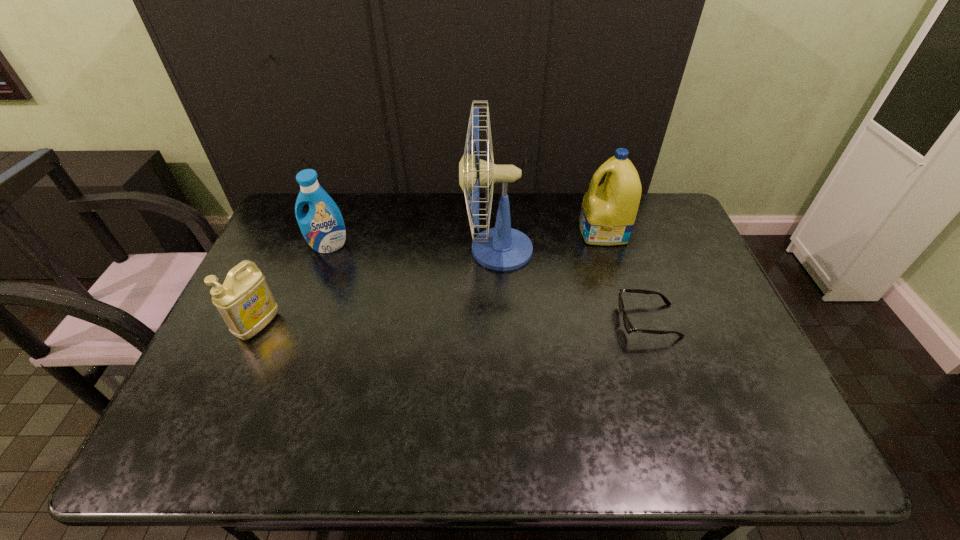
At what (x,y) coordinates should I click in order to perform the action: click on vacant space at the near edge of the desktop. Please return your answer as a coordinate pair (x, y). Looking at the image, I should click on (297, 445).

Where is `blank space at the left edge`? blank space at the left edge is located at coordinates (274, 335).

The image size is (960, 540). Identify the location of vacant area at the right edge of the desktop. (660, 262).

The width and height of the screenshot is (960, 540). What are the coordinates of `vacant space at the near left corner` in the screenshot? It's located at (180, 447).

Image resolution: width=960 pixels, height=540 pixels. What are the coordinates of `unoccupied area between the spectacles and the rightmost detergent` in the screenshot? It's located at coord(626,276).

What are the coordinates of `vacant point located between the nearest detergent and the rightmost detergent` in the screenshot? It's located at (431, 279).

Find the location of a particular element. Image resolution: width=960 pixels, height=540 pixels. free area in between the rightmost detergent and the shortest object is located at coordinates (626, 276).

The width and height of the screenshot is (960, 540). Find the location of `vacant point located between the fan and the nearest detergent`. vacant point located between the fan and the nearest detergent is located at coordinates (378, 287).

This screenshot has height=540, width=960. Find the location of `vacant space that is in between the rightmost detergent and the fan`. vacant space that is in between the rightmost detergent and the fan is located at coordinates (550, 241).

Image resolution: width=960 pixels, height=540 pixels. I want to click on the third closest object to the third object from left to right, so pyautogui.click(x=323, y=228).